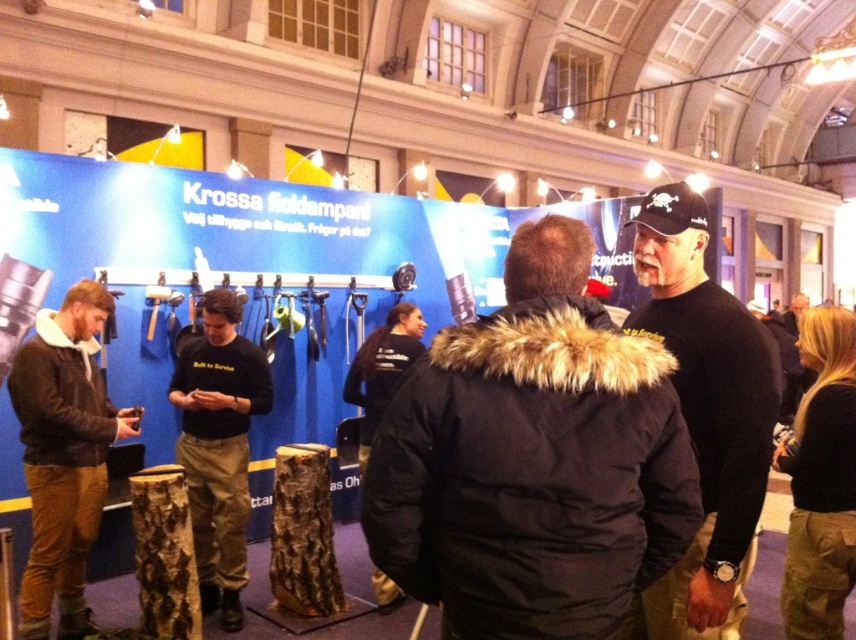
Question: Considering the relative positions of brown suede jacket at left and black cotton shirt at center in the image provided, where is brown suede jacket at left located with respect to black cotton shirt at center?

Choices:
 (A) right
 (B) left

Answer: (B)

Question: Can you confirm if black fur-lined jacket at center is positioned above black cotton shirt at center?

Choices:
 (A) yes
 (B) no

Answer: (A)

Question: Which point is closer to the camera taking this photo?

Choices:
 (A) (789, 332)
 (B) (230, 474)
 (C) (61, 618)
 (D) (669, 637)

Answer: (D)

Question: Which of the following is the closest to the observer?

Choices:
 (A) (486, 467)
 (B) (792, 305)

Answer: (A)

Question: Among these points, which one is farthest from the camera?

Choices:
 (A) (431, 596)
 (B) (791, 321)

Answer: (B)

Question: Can you confirm if black fur-lined jacket at center is bigger than black cotton shirt at center?

Choices:
 (A) yes
 (B) no

Answer: (B)